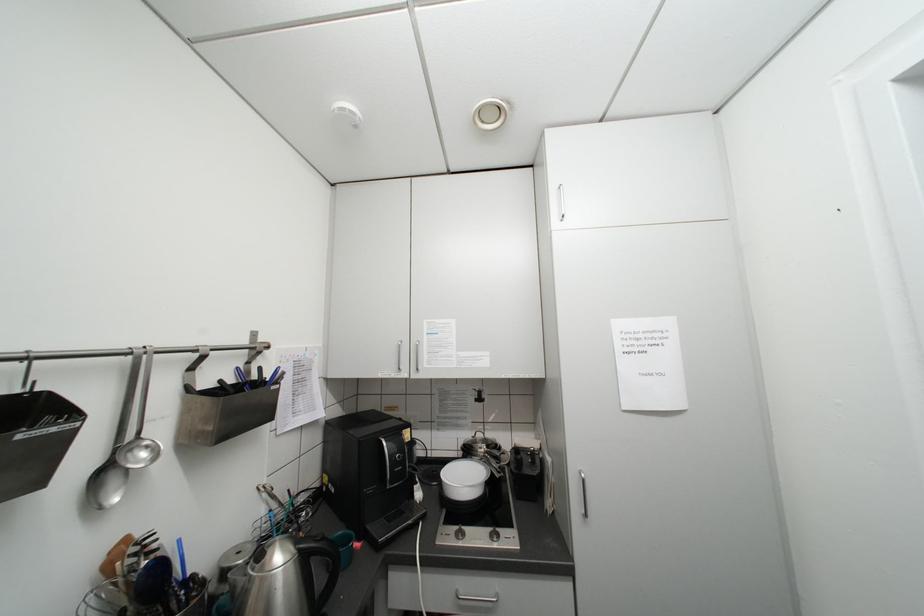
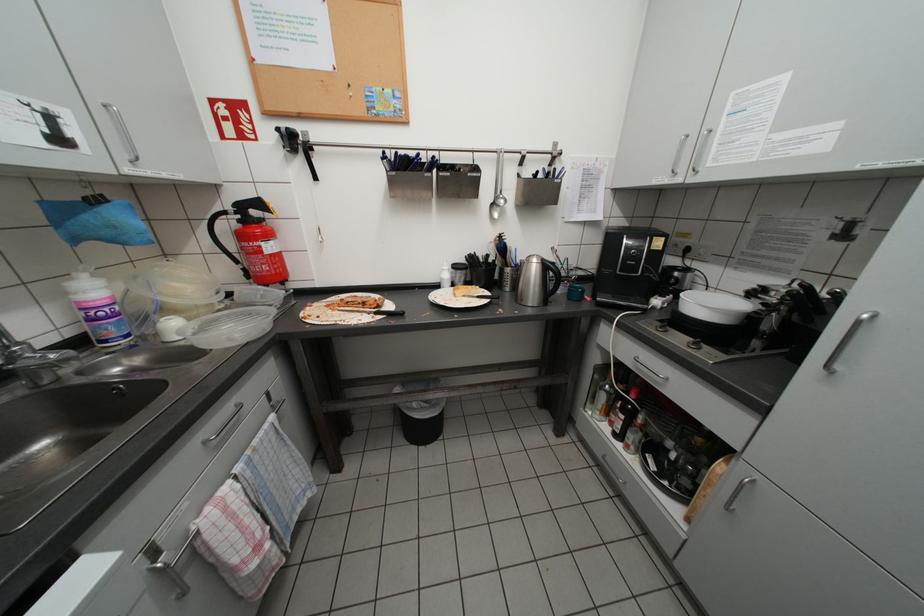
First-person continuous shooting, in which direction is the camera rotating?

The camera rotated toward left-down.